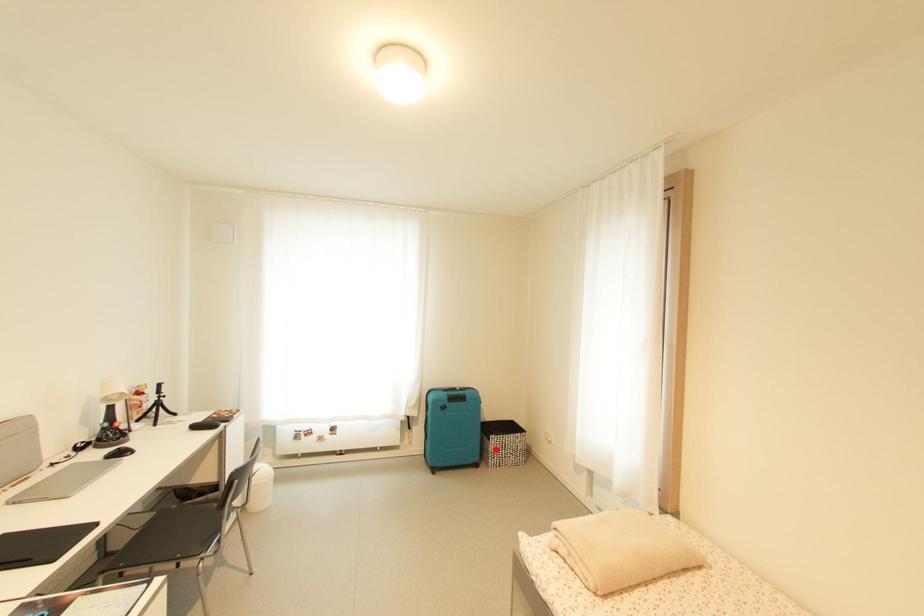
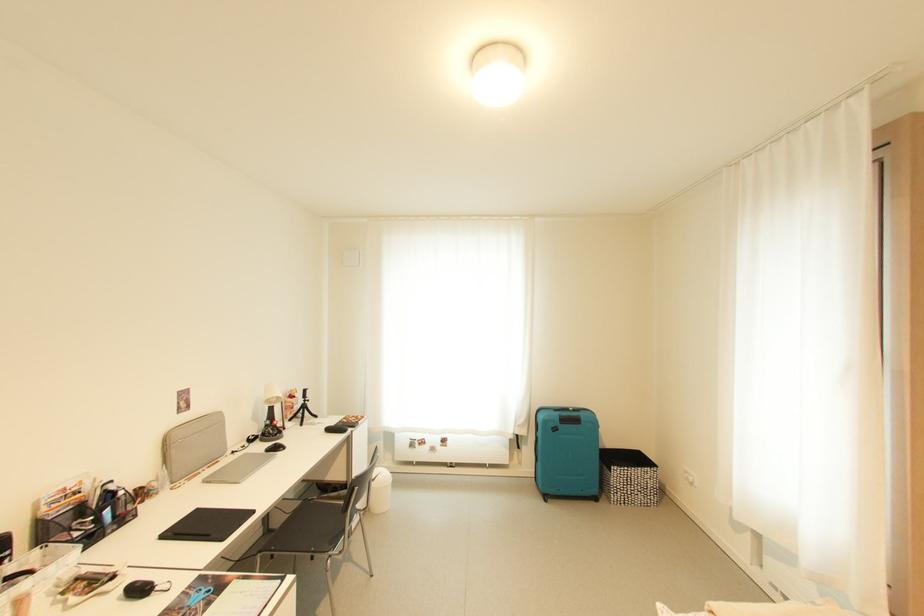
Question: I am providing you with two images of the same scene from different viewpoints. Given a red point in image1, look at the same physical point in image2. Is it:

Choices:
 (A) Closer to the viewpoint
 (B) Farther from the viewpoint

Answer: (A)